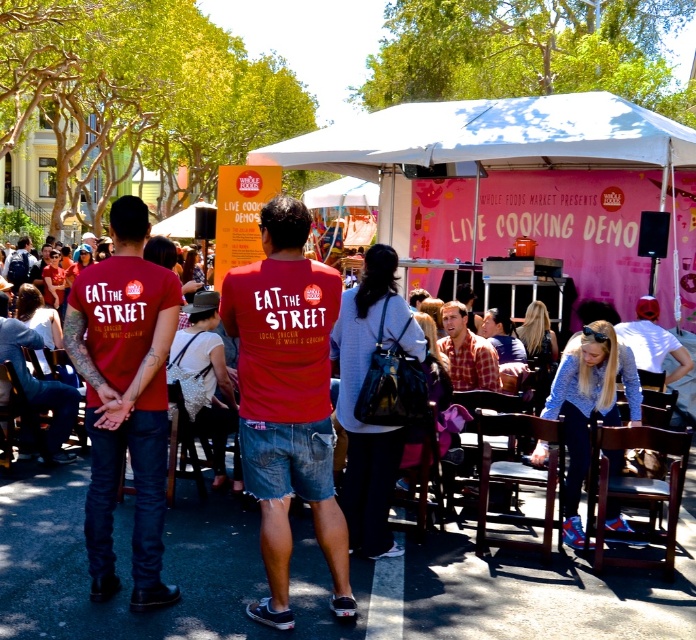
The image size is (696, 640). Identify the location of matte red t-shirt at left. (125, 397).

Is matte red t-shirt at left to the right of white fabric tent at center from the viewer's perspective?

Incorrect, matte red t-shirt at left is not on the right side of white fabric tent at center.

Is point (81, 284) closer to camera compared to point (557, 100)?

That is True.

At what (x,y) coordinates should I click in order to perform the action: click on matte red t-shirt at left. Please return your answer as a coordinate pair (x, y). Looking at the image, I should click on (125, 397).

Which is in front, point (317, 419) or point (363, 138)?

Positioned in front is point (317, 419).

Does red cotton t-shirt at center have a lesser width compared to white fabric tent at center?

Indeed, red cotton t-shirt at center has a lesser width compared to white fabric tent at center.

Measure the distance between point (299, 246) and camera.

Point (299, 246) is 4.68 meters from camera.

Where is `red cotton t-shirt at center`? red cotton t-shirt at center is located at coordinates (285, 401).

Is matte red t-shirt at left further to the viewer compared to light blue denim shorts at lower right?

That is False.

Which is below, matte red t-shirt at left or light blue denim shorts at lower right?

matte red t-shirt at left is lower down.

This screenshot has height=640, width=696. What are the coordinates of `matte red t-shirt at left` in the screenshot? It's located at (125, 397).